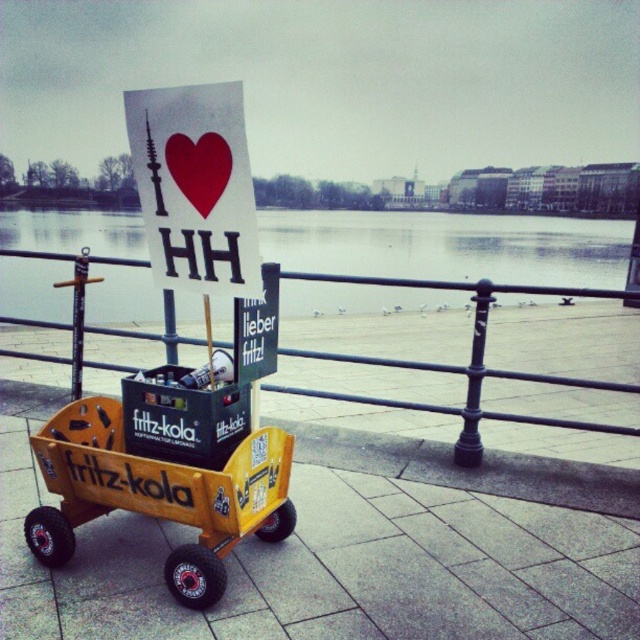
Which is behind, point (72, 497) or point (237, 138)?

The point (72, 497) is more distant.

Between yellow plastic cart at center and white paper sign at upper center, which one is positioned higher?

Positioned higher is white paper sign at upper center.

Describe the element at coordinates (157, 493) in the screenshot. The width and height of the screenshot is (640, 640). I see `yellow plastic cart at center` at that location.

I want to click on yellow plastic cart at center, so click(x=157, y=493).

Can you confirm if yellow wood cart at center is thinner than matte paper heart at center?

Incorrect, yellow wood cart at center's width is not less than matte paper heart at center's.

Can you confirm if yellow wood cart at center is bigger than matte paper heart at center?

Correct, yellow wood cart at center is larger in size than matte paper heart at center.

Which is behind, point (440, 449) or point (224, 166)?

Point (440, 449)

The height and width of the screenshot is (640, 640). Identify the location of yellow wood cart at center. (339, 554).

Which of these two, yellow wood cart at center or yellow plastic cart at center, stands taller?

With more height is yellow plastic cart at center.

Who is more distant from viewer, (307, 522) or (205, 554)?

Point (307, 522)

What are the coordinates of `yellow wood cart at center` in the screenshot? It's located at (339, 554).